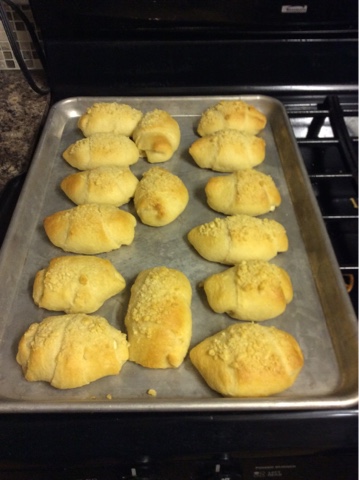
Where is `tile`? Image resolution: width=359 pixels, height=480 pixels. tile is located at coordinates (16, 57).